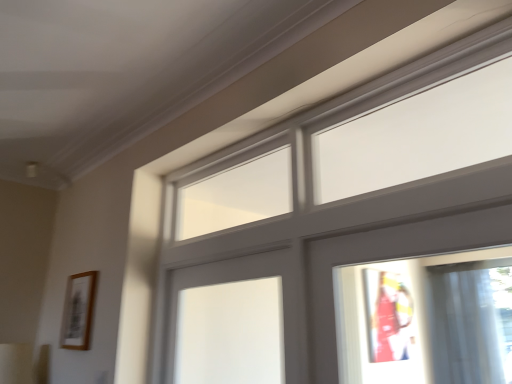
The width and height of the screenshot is (512, 384). Describe the element at coordinates (349, 233) in the screenshot. I see `matte gray window at upper center` at that location.

Image resolution: width=512 pixels, height=384 pixels. What are the coordinates of `matte gray window at upper center` in the screenshot? It's located at (349, 233).

The height and width of the screenshot is (384, 512). What do you see at coordinates (78, 311) in the screenshot? I see `wooden picture frame at left` at bounding box center [78, 311].

What is the approximate width of wooden picture frame at left?

wooden picture frame at left is 4.41 centimeters wide.

Where is `wooden picture frame at left`? This screenshot has width=512, height=384. wooden picture frame at left is located at coordinates (78, 311).

You are a GUI agent. You are given a task and a screenshot of the screen. Output one action in this format:
    pyautogui.click(x=<x>, y=<y>)
    Task: Click on the matte gray window at upper center
    The height and width of the screenshot is (384, 512).
    Given the screenshot: What is the action you would take?
    pyautogui.click(x=349, y=233)

Would you say matte gray window at upper center is to the left or to the right of wooden picture frame at left in the picture?

matte gray window at upper center is positioned on wooden picture frame at left's right side.

Which is behind, matte gray window at upper center or wooden picture frame at left?

wooden picture frame at left is further from the camera.

Does point (213, 192) lie behind point (87, 348)?

Yes, it is behind point (87, 348).

From the image's perspective, would you say matte gray window at upper center is shown under wooden picture frame at left?

No, from the image's perspective, matte gray window at upper center is not below wooden picture frame at left.

From a real-world perspective, is matte gray window at upper center beneath wooden picture frame at left?

Actually, matte gray window at upper center is physically above wooden picture frame at left in the real world.

Does matte gray window at upper center have a lesser width compared to wooden picture frame at left?

In fact, matte gray window at upper center might be wider than wooden picture frame at left.

From their relative heights in the image, would you say matte gray window at upper center is taller or shorter than wooden picture frame at left?

Considering their sizes, matte gray window at upper center has more height than wooden picture frame at left.

Can you confirm if matte gray window at upper center is bigger than wooden picture frame at left?

Correct, matte gray window at upper center is larger in size than wooden picture frame at left.

Is matte gray window at upper center spatially inside wooden picture frame at left, or outside of it?

matte gray window at upper center lies outside wooden picture frame at left.

Is matte gray window at upper center next to wooden picture frame at left?

Result: No, matte gray window at upper center is not in contact with wooden picture frame at left.

Is matte gray window at upper center aimed at wooden picture frame at left?

No, matte gray window at upper center is not oriented towards wooden picture frame at left.

How different are the orientations of matte gray window at upper center and wooden picture frame at left in degrees?

The angle between the facing direction of matte gray window at upper center and the facing direction of wooden picture frame at left is 0.753 degrees.

Measure the distance between matte gray window at upper center and wooden picture frame at left.

A distance of 33.68 inches exists between matte gray window at upper center and wooden picture frame at left.

Identify the location of window on the right of wooden picture frame at left. This screenshot has height=384, width=512. (349, 233).

Does wooden picture frame at left appear on the right side of matte gray window at upper center?

No.

Is wooden picture frame at left closer to camera compared to matte gray window at upper center?

No, the depth of wooden picture frame at left is greater than that of matte gray window at upper center.

Does point (65, 326) appear closer or farther from the camera than point (495, 55)?

Point (65, 326) appears to be farther away from the viewer than point (495, 55).

In the scene shown: From the image's perspective, relative to matte gray window at upper center, is wooden picture frame at left above or below?

wooden picture frame at left is situated lower than matte gray window at upper center in the image.

From a real-world perspective, is wooden picture frame at left positioned above or below matte gray window at upper center?

In terms of real-world spatial position, wooden picture frame at left is below matte gray window at upper center.

Which of these two, wooden picture frame at left or matte gray window at upper center, is wider?

Wider between the two is matte gray window at upper center.

Does wooden picture frame at left have a greater height compared to matte gray window at upper center?

Incorrect, the height of wooden picture frame at left is not larger of that of matte gray window at upper center.

In terms of size, does wooden picture frame at left appear bigger or smaller than matte gray window at upper center?

Clearly, wooden picture frame at left is smaller in size than matte gray window at upper center.

Would you say wooden picture frame at left is inside or outside matte gray window at upper center?

The correct answer is: outside.

Are wooden picture frame at left and matte gray window at upper center making contact?

No, wooden picture frame at left is not in contact with matte gray window at upper center.

Could you tell me if wooden picture frame at left is turned towards matte gray window at upper center?

No, wooden picture frame at left is not facing towards matte gray window at upper center.

Locate an element on the screen. The image size is (512, 384). window on the right side of wooden picture frame at left is located at coordinates (349, 233).

Locate an element on the screen. The image size is (512, 384). window above the wooden picture frame at left (from a real-world perspective) is located at coordinates (349, 233).

This screenshot has height=384, width=512. What are the coordinates of `window lying in front of the wooden picture frame at left` in the screenshot? It's located at point(349,233).